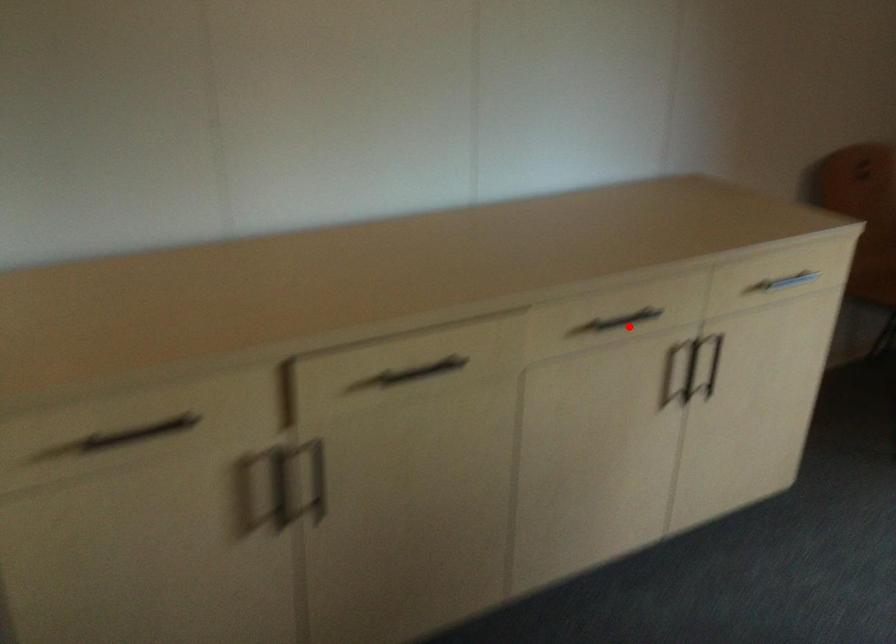
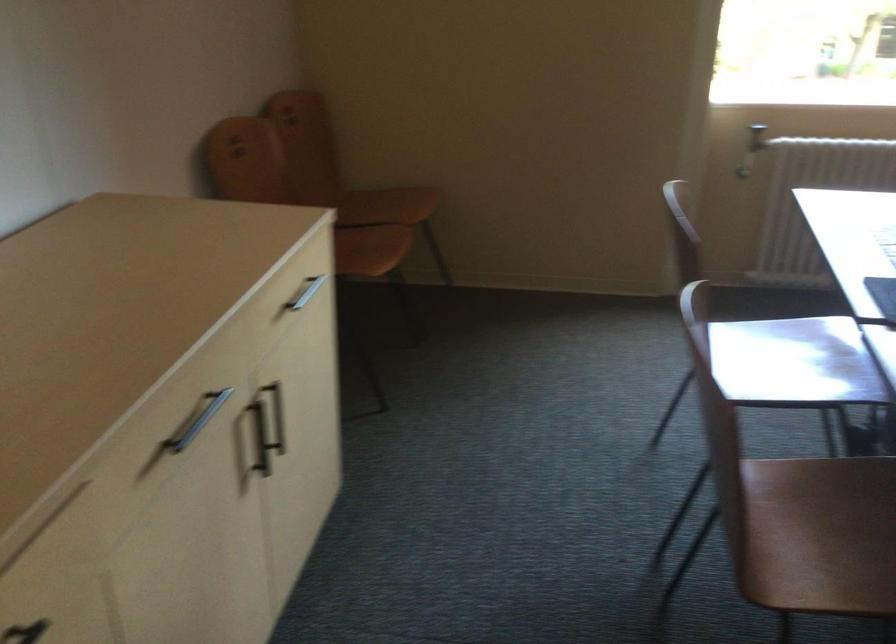
Question: I am providing you with two images of the same scene from different viewpoints. In image1, a red point is highlighted. Considering the same 3D point in image2, which of the following is correct?

Choices:
 (A) It is closer
 (B) It is farther

Answer: (A)